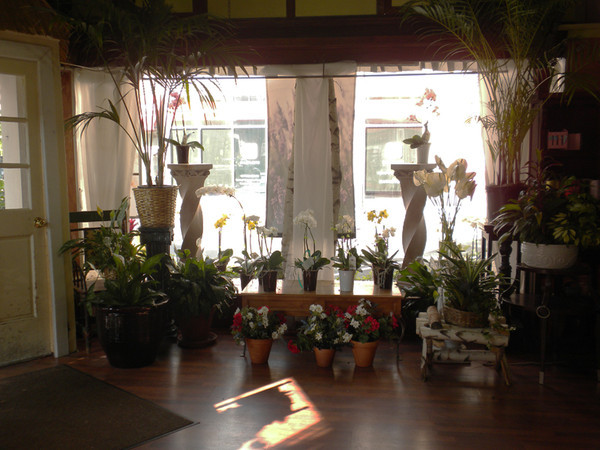
This screenshot has width=600, height=450. In order to click on woven basket in this screenshot , I will do `click(154, 205)`.